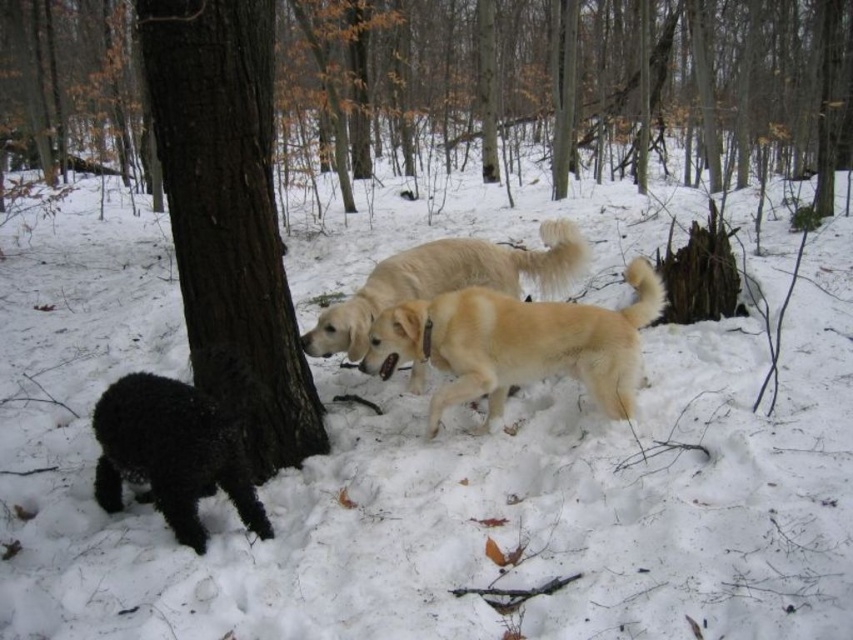
Question: Does brown rough tree trunk at center appear on the left side of light golden fur at center?

Choices:
 (A) yes
 (B) no

Answer: (A)

Question: Is golden fur dog at center below shiny black dog at lower left?

Choices:
 (A) yes
 (B) no

Answer: (B)

Question: Is the position of dark brown bark at center more distant than that of shiny black dog at lower left?

Choices:
 (A) no
 (B) yes

Answer: (B)

Question: Which object is farther from the camera taking this photo?

Choices:
 (A) dark brown bark at center
 (B) light golden fur at center
 (C) golden fur dog at center

Answer: (B)

Question: Which point is farther to the camera?

Choices:
 (A) dark brown bark at center
 (B) shiny black dog at lower left
 (C) golden fur dog at center
 (D) light golden fur at center

Answer: (D)

Question: Which point appears closest to the camera in this image?

Choices:
 (A) (729, 129)
 (B) (248, 316)
 (C) (403, 314)

Answer: (B)